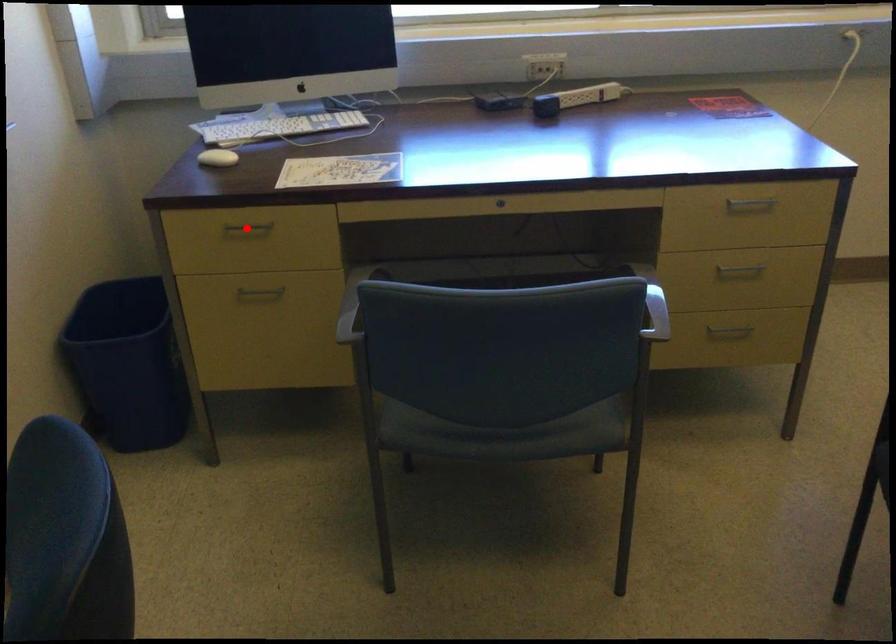
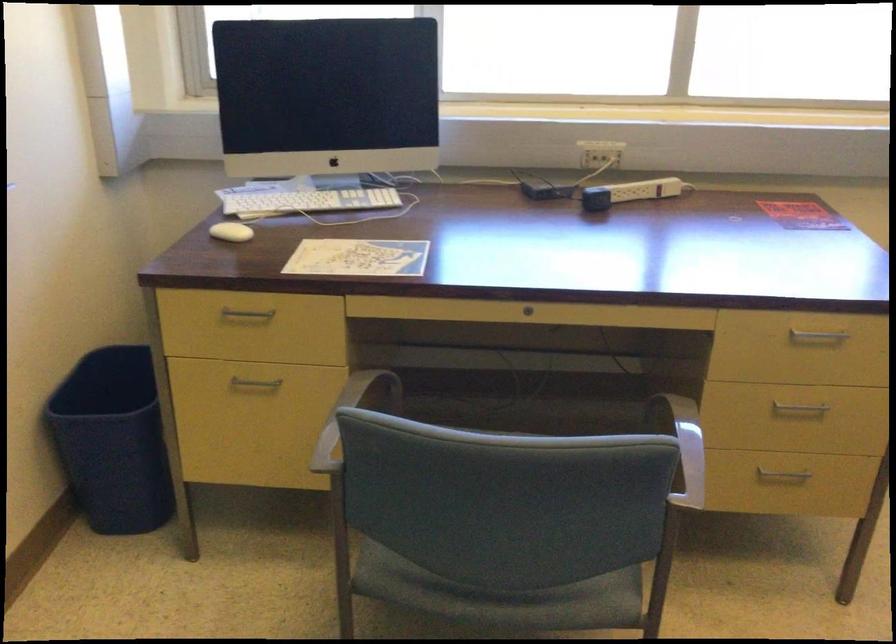
Find the pixel in the second image that matches the highlighted location in the first image.

(247, 313)